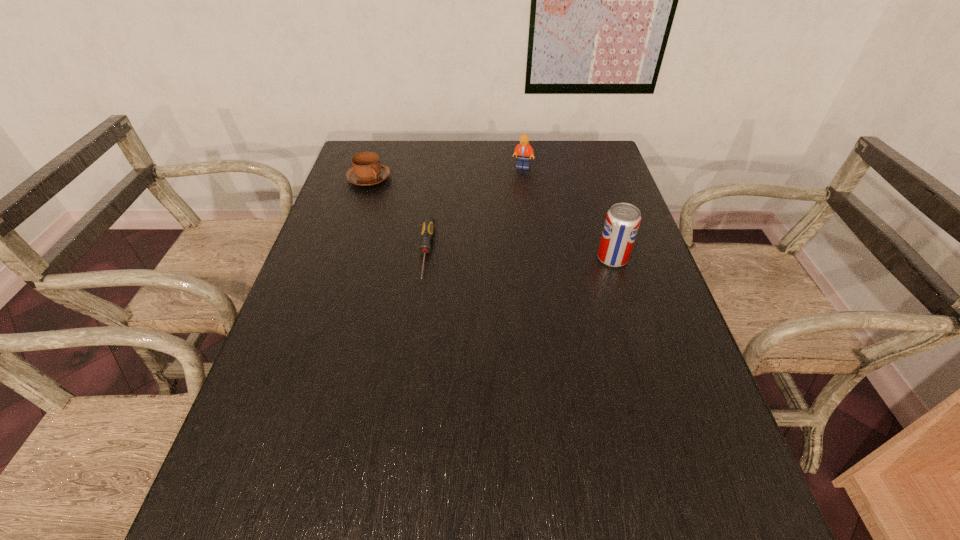
Where is `vacant region between the tallest object and the cappuccino`? vacant region between the tallest object and the cappuccino is located at coordinates (491, 218).

Find the location of a particular element. Image resolution: width=960 pixels, height=540 pixels. vacant region between the screwdriver and the rightmost object is located at coordinates (519, 255).

This screenshot has height=540, width=960. I want to click on unoccupied area between the tallest object and the third tallest object, so click(x=491, y=218).

In order to click on blank region between the leftmost object and the shortest object in this screenshot , I will do `click(397, 215)`.

The width and height of the screenshot is (960, 540). What are the coordinates of `free area in between the soda and the cappuccino` in the screenshot? It's located at (491, 218).

This screenshot has width=960, height=540. I want to click on free space that is in between the soda and the leftmost object, so click(x=491, y=218).

Locate an element on the screen. object that is the third closest to the cappuccino is located at coordinates (622, 222).

Image resolution: width=960 pixels, height=540 pixels. Identify the location of object that is the second nearest to the shortest object. (523, 150).

Locate an element on the screen. free space that satisfies the following two spatial constraints: 1. insert the second object from left to right into a screw head; 2. on the right side of the soda is located at coordinates (425, 258).

This screenshot has width=960, height=540. Identify the location of blank area in the image that satisfies the following two spatial constraints: 1. insert the third object from right to left into a screw head; 2. on the right side of the rightmost object. (425, 258).